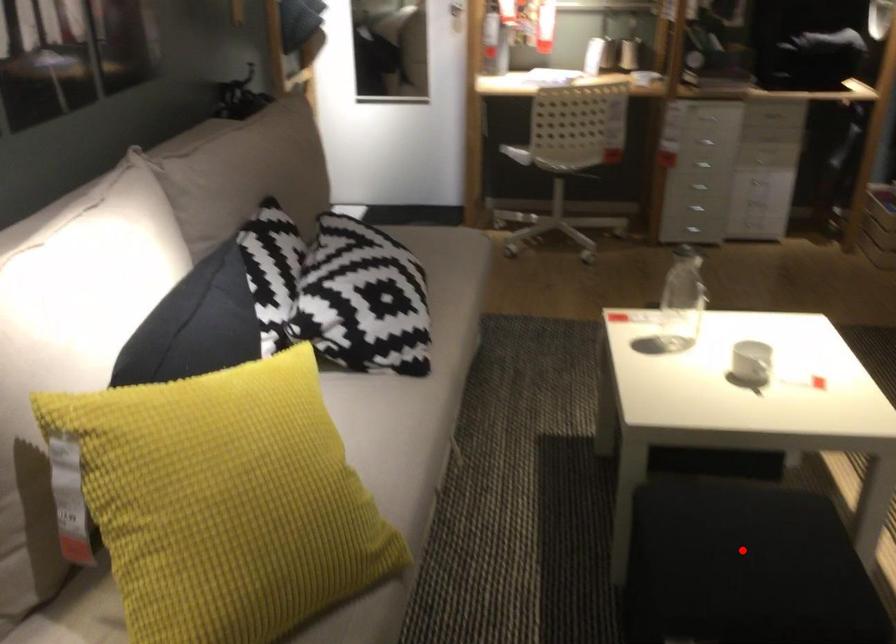
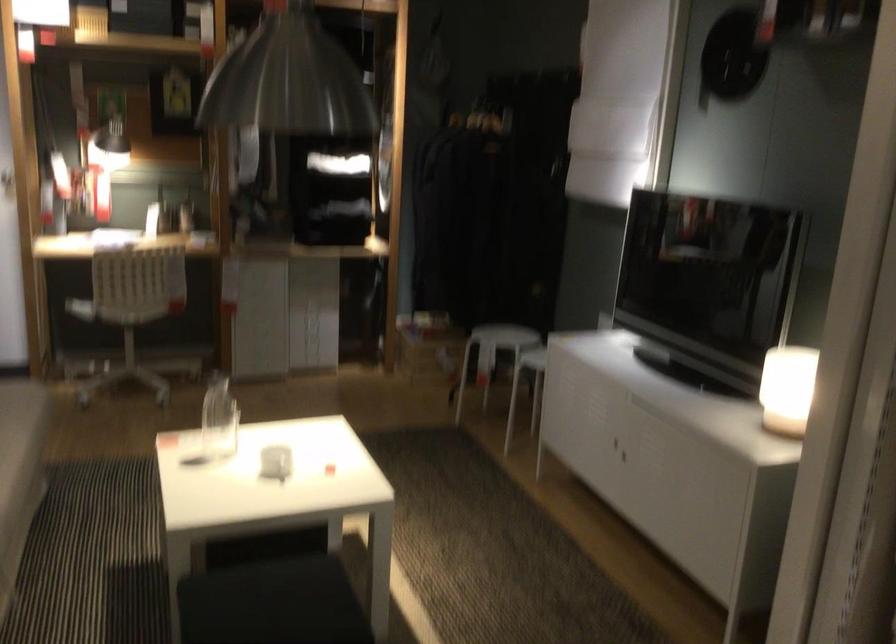
Question: I am providing you with two images of the same scene from different viewpoints. In image1, a red point is highlighted. Considering the same 3D point in image2, which of the following is correct?

Choices:
 (A) It is closer
 (B) It is farther

Answer: (B)